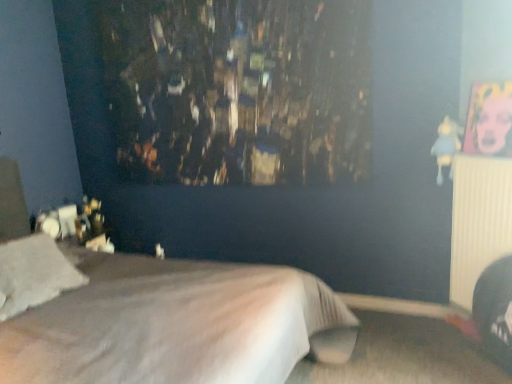
Question: Is white soft pillow at lower left taller or shorter than white soft bed at center?

Choices:
 (A) short
 (B) tall

Answer: (A)

Question: In the image, is white soft pillow at lower left positioned in front of or behind white soft bed at center?

Choices:
 (A) front
 (B) behind

Answer: (B)

Question: Considering the real-world distances, which object is closest to the blue fabric doll at upper right?

Choices:
 (A) white ribbed radiator at right
 (B) white soft pillow at lower left
 (C) white soft bed at center

Answer: (A)

Question: Based on their relative distances, which object is nearer to the white soft pillow at lower left?

Choices:
 (A) white ribbed radiator at right
 (B) white soft bed at center
 (C) blue fabric doll at upper right

Answer: (B)